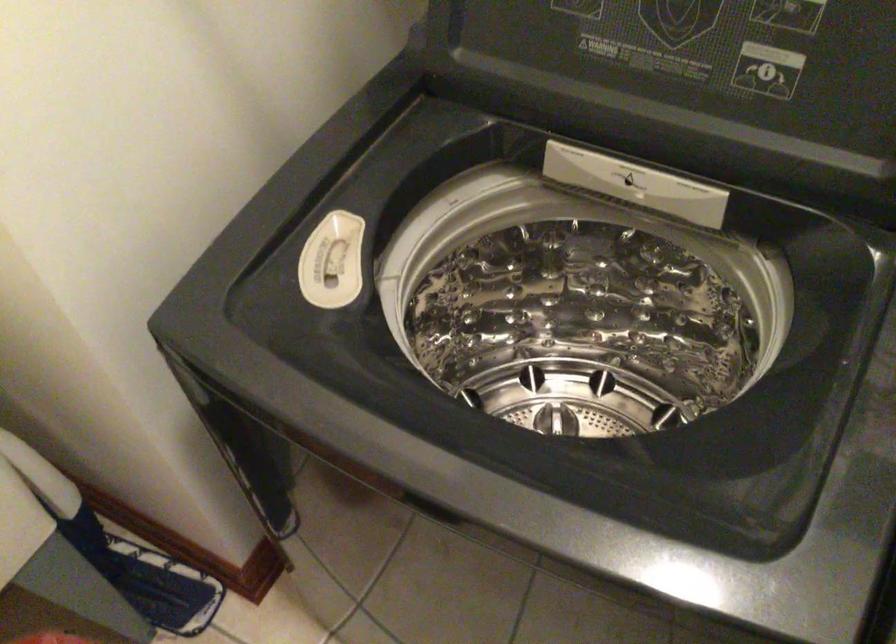
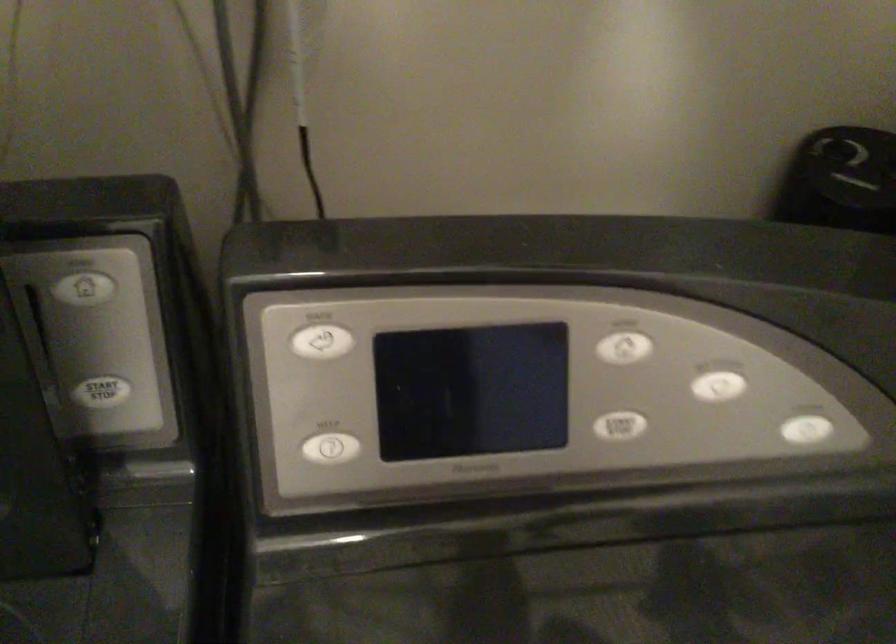
Question: How did the camera likely rotate?

Choices:
 (A) Left
 (B) Right
 (C) Up
 (D) Down

Answer: (B)